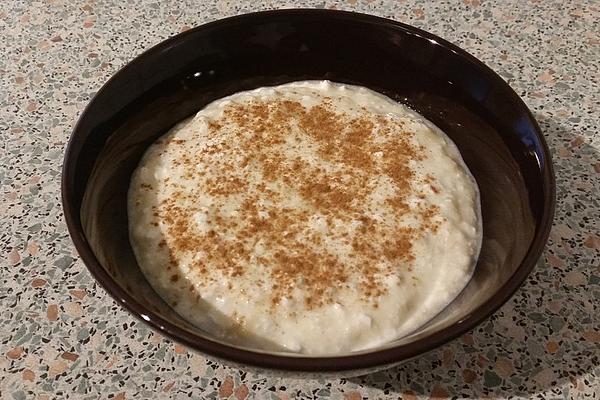
Where is `countertop bottom left of bowl`? countertop bottom left of bowl is located at coordinates (56, 355).